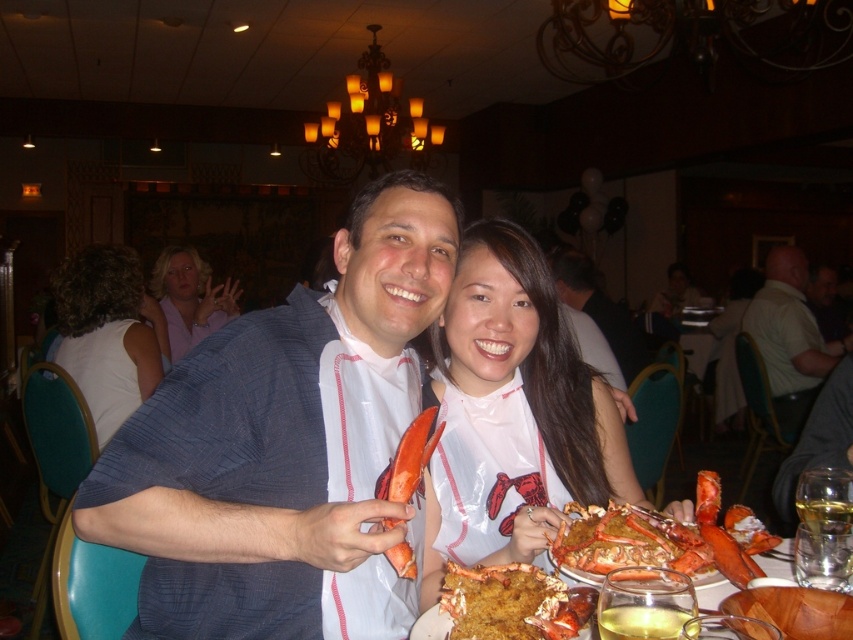
From the picture: Can you confirm if white fabric shirt at left is thinner than orange smooth lobster at center?

Incorrect, white fabric shirt at left's width is not less than orange smooth lobster at center's.

Is point (93, 340) closer to camera compared to point (404, 461)?

No, (93, 340) is further to viewer.

Where is `white fabric shirt at left`? white fabric shirt at left is located at coordinates (107, 333).

Based on the photo, is matte white shirt at center to the right of matte lobster at center from the viewer's perspective?

Correct, you'll find matte white shirt at center to the right of matte lobster at center.

Is matte white shirt at center smaller than matte lobster at center?

Actually, matte white shirt at center might be larger than matte lobster at center.

You are a GUI agent. You are given a task and a screenshot of the screen. Output one action in this format:
    pyautogui.click(x=<x>, y=<y>)
    Task: Click on the matte white shirt at center
    The image size is (853, 640).
    Given the screenshot: What is the action you would take?
    pyautogui.click(x=598, y=308)

The image size is (853, 640). Find the location of `matte white shirt at center`. matte white shirt at center is located at coordinates (598, 308).

Does white glossy shirt at center have a greater height compared to white fabric shirt at left?

No, white glossy shirt at center is not taller than white fabric shirt at left.

Between white glossy shirt at center and white fabric shirt at left, which one appears on the right side from the viewer's perspective?

From the viewer's perspective, white glossy shirt at center appears more on the right side.

You are a GUI agent. You are given a task and a screenshot of the screen. Output one action in this format:
    pyautogui.click(x=<x>, y=<y>)
    Task: Click on the white glossy shirt at center
    Image resolution: width=853 pixels, height=640 pixels.
    Given the screenshot: What is the action you would take?
    coord(514,412)

Locate an element on the screen. white glossy shirt at center is located at coordinates (514, 412).